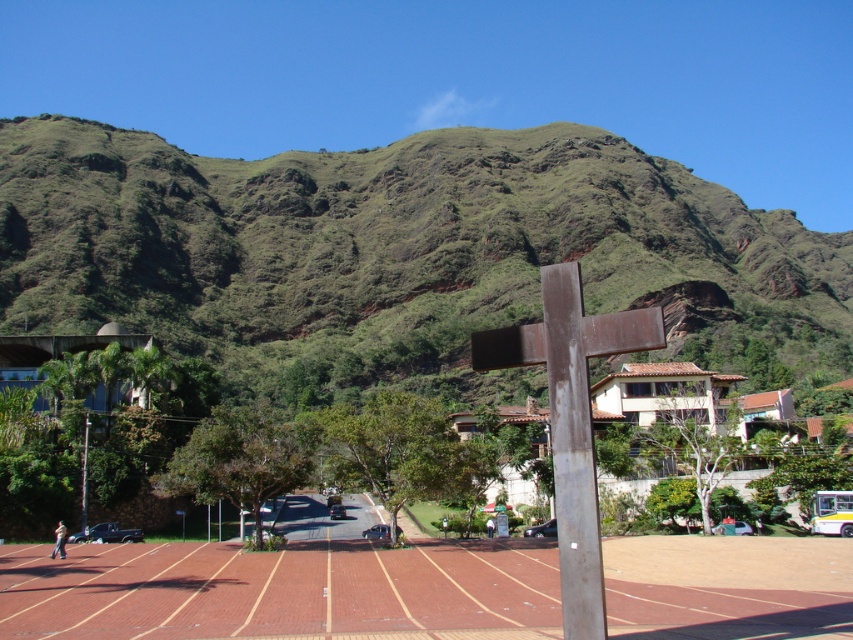
You are a hiker planning to take a photo of the rusty metal cross at center and the green grassy hill at upper center. Which object should you focus on first if you want to capture both in a single frame without moving your camera?

The green grassy hill at upper center is taller than the rusty metal cross at center, so you should focus on the green grassy hill at upper center first to ensure both objects are in focus.

You are a drone operator planning to fly a drone over the brick textured race track at center and the rusty metal cross at center. According to the scene, which object is positioned lower in the image?

The brick textured race track at center is located below the rusty metal cross at center, so it is positioned lower in the image.

You are standing at the base of the mountain looking towards the paved area. There are two points marked on the image, one at coordinates point (x=651, y=205) and another at point (x=4, y=561). Which point is closer to your current position?

Point (x=651, y=205) is further to the camera than point (x=4, y=561), so the point closer to your current position is point (x=4, y=561).